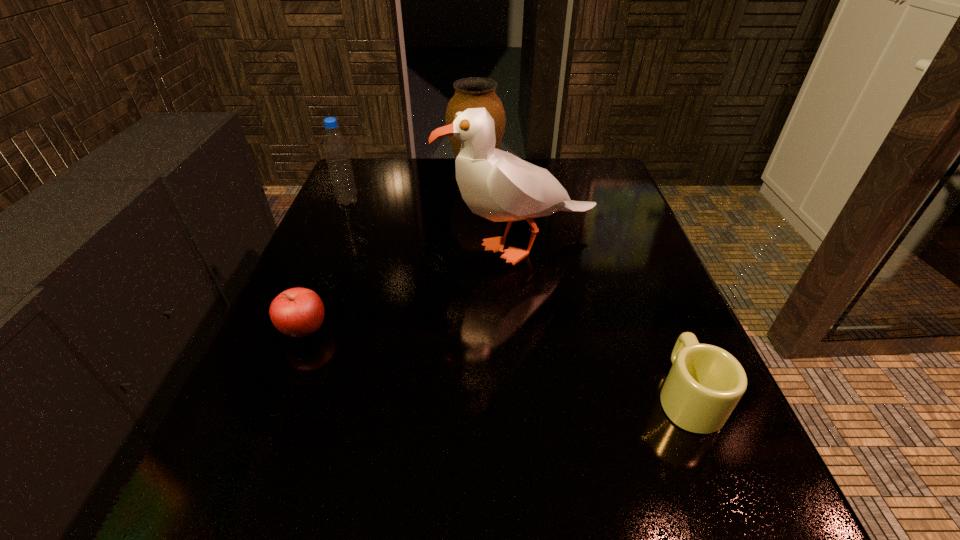
Locate an element on the screen. The width and height of the screenshot is (960, 540). free space located on the right of the farthest object is located at coordinates (555, 175).

Where is `free space located on the front of the water bottle`? free space located on the front of the water bottle is located at coordinates (323, 261).

Where is `vacant area situated with the handle on the side of the rightmost object`? The image size is (960, 540). vacant area situated with the handle on the side of the rightmost object is located at coordinates (659, 326).

You are a GUI agent. You are given a task and a screenshot of the screen. Output one action in this format:
    pyautogui.click(x=<x>, y=<y>)
    Task: Click on the free point located 0.290m with the handle on the side of the rightmost object
    
    Given the screenshot: What is the action you would take?
    pyautogui.click(x=629, y=253)

Locate an element on the screen. The height and width of the screenshot is (540, 960). vacant point located with the handle on the side of the rightmost object is located at coordinates (661, 334).

Locate an element on the screen. The width and height of the screenshot is (960, 540). vacant space located 0.350m on the back of the second nearest object is located at coordinates (352, 210).

Locate an element on the screen. This screenshot has width=960, height=540. urn at the far edge is located at coordinates (474, 92).

Find the location of a particular element. This screenshot has height=540, width=960. water bottle located in the far edge section of the desktop is located at coordinates (335, 147).

Identify the location of water bottle present at the left edge. (335, 147).

The image size is (960, 540). I want to click on apple that is positioned at the left edge, so click(298, 312).